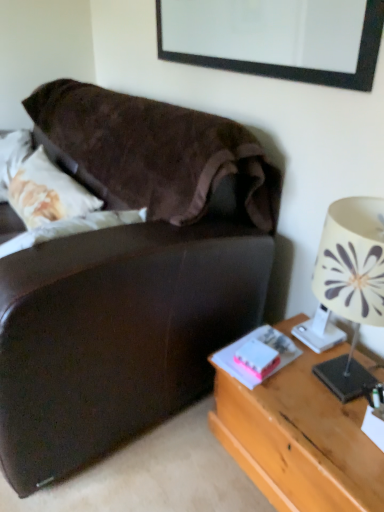
Question: Is black matte picture frame at upper center touching pink matte book at lower right, acting as the second book starting from the left?

Choices:
 (A) no
 (B) yes

Answer: (A)

Question: Considering the relative sizes of black matte picture frame at upper center and pink matte book at lower right, acting as the second book starting from the left, in the image provided, is black matte picture frame at upper center wider than pink matte book at lower right, acting as the second book starting from the left,?

Choices:
 (A) yes
 (B) no

Answer: (B)

Question: Is black matte picture frame at upper center facing away from pink matte book at lower right, acting as the second book starting from the left?

Choices:
 (A) yes
 (B) no

Answer: (B)

Question: Does black matte picture frame at upper center have a greater height compared to pink matte book at lower right, which ranks as the first book in right-to-left order?

Choices:
 (A) no
 (B) yes

Answer: (B)

Question: Can you confirm if black matte picture frame at upper center is positioned to the right of pink matte book at lower right, which ranks as the first book in right-to-left order?

Choices:
 (A) no
 (B) yes

Answer: (A)

Question: From a real-world perspective, is wooden desk at right above or below white matte book at lower right, which is the second book from right to left?

Choices:
 (A) above
 (B) below

Answer: (B)

Question: Is wooden desk at right in front of or behind white matte book at lower right, the 1th book viewed from the left, in the image?

Choices:
 (A) behind
 (B) front

Answer: (B)

Question: Is wooden desk at right wider or thinner than white matte book at lower right, the 1th book viewed from the left?

Choices:
 (A) thin
 (B) wide

Answer: (B)

Question: Is point (337, 455) positioned closer to the camera than point (259, 356)?

Choices:
 (A) farther
 (B) closer

Answer: (B)

Question: Based on their sizes in the image, would you say pink matte book at lower right, which ranks as the first book in right-to-left order, is bigger or smaller than wooden desk at right?

Choices:
 (A) small
 (B) big

Answer: (A)

Question: From their relative heights in the image, would you say pink matte book at lower right, which ranks as the first book in right-to-left order, is taller or shorter than wooden desk at right?

Choices:
 (A) tall
 (B) short

Answer: (B)

Question: From a real-world perspective, relative to wooden desk at right, is pink matte book at lower right, which ranks as the first book in right-to-left order, vertically above or below?

Choices:
 (A) below
 (B) above

Answer: (B)

Question: From the image's perspective, relative to wooden desk at right, is pink matte book at lower right, acting as the second book starting from the left, above or below?

Choices:
 (A) above
 (B) below

Answer: (A)

Question: Is white fabric lampshade at right wider or thinner than wooden desk at right?

Choices:
 (A) thin
 (B) wide

Answer: (A)

Question: From the image's perspective, is white fabric lampshade at right located above or below wooden desk at right?

Choices:
 (A) below
 (B) above

Answer: (B)